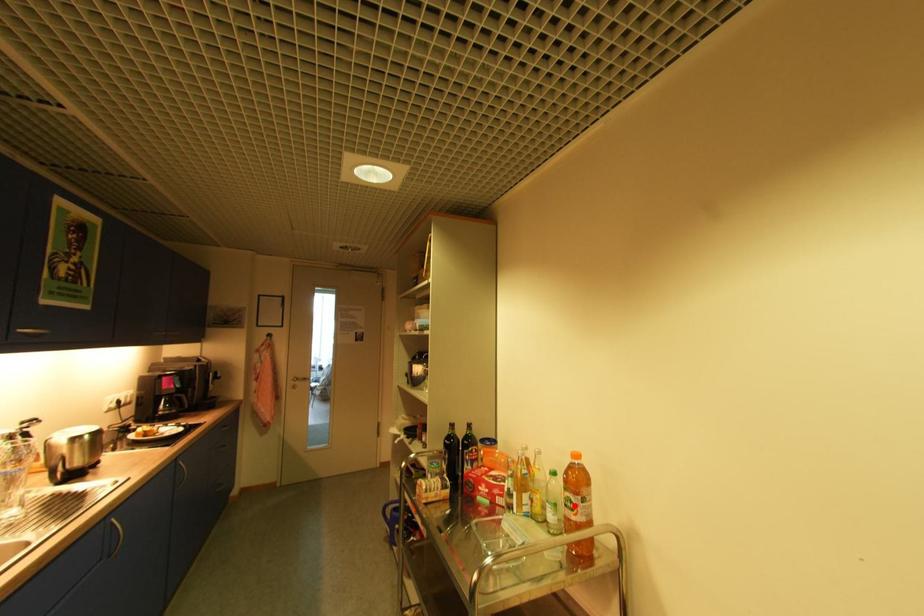
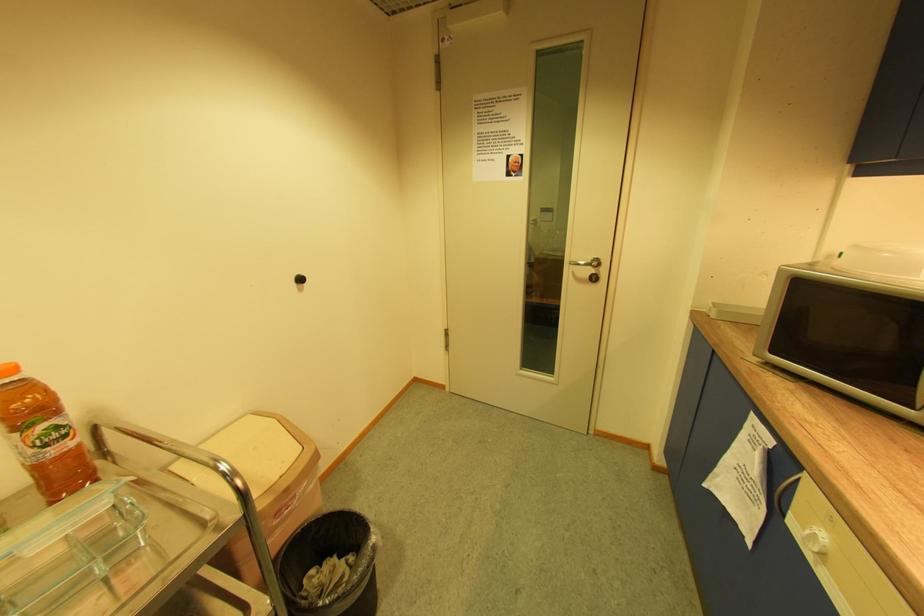
In the second image, find the point that corresponds to the highlighted location in the first image.

(61, 437)